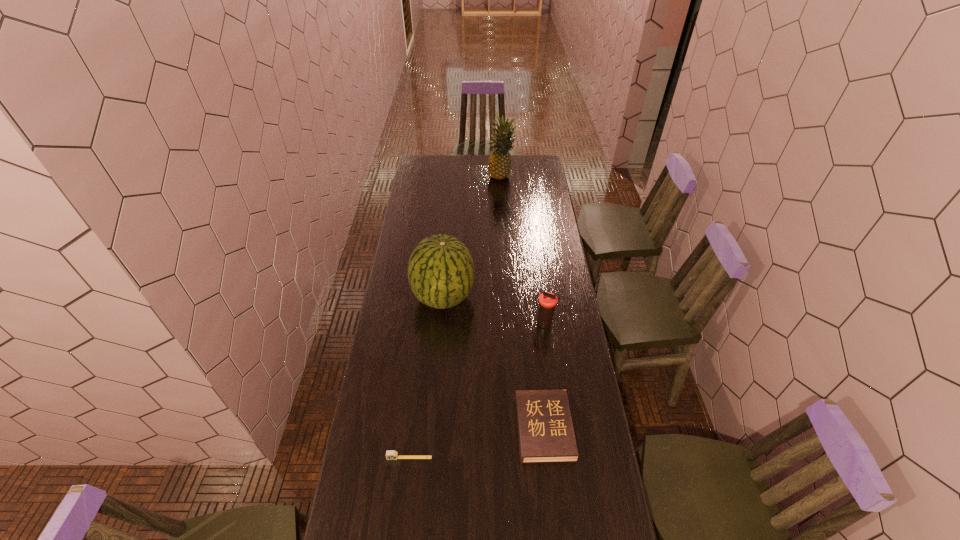
Where is `free spot between the tape measure and the third tallest object`? Image resolution: width=960 pixels, height=540 pixels. free spot between the tape measure and the third tallest object is located at coordinates (477, 391).

Identify the location of vacant area that lies between the thermos bottle and the farthest object. (523, 251).

The width and height of the screenshot is (960, 540). Find the location of `vacant space that's between the fourth shortest object and the hardback book`. vacant space that's between the fourth shortest object and the hardback book is located at coordinates (493, 363).

Locate an element on the screen. Image resolution: width=960 pixels, height=540 pixels. free spot between the shortest object and the thermos bottle is located at coordinates (477, 391).

Locate an element on the screen. The image size is (960, 540). free space between the fourth shortest object and the thermos bottle is located at coordinates 494,311.

I want to click on vacant space that's between the hardback book and the third shortest object, so click(x=544, y=376).

Image resolution: width=960 pixels, height=540 pixels. Identify the location of vacant area that lies between the fourth shortest object and the hardback book. (493, 363).

Where is `unoccupied area between the pineapple and the hardback book`? This screenshot has width=960, height=540. unoccupied area between the pineapple and the hardback book is located at coordinates (523, 303).

I want to click on free space between the hardback book and the thermos bottle, so click(544, 376).

I want to click on the third closest object relative to the pineapple, so [545, 430].